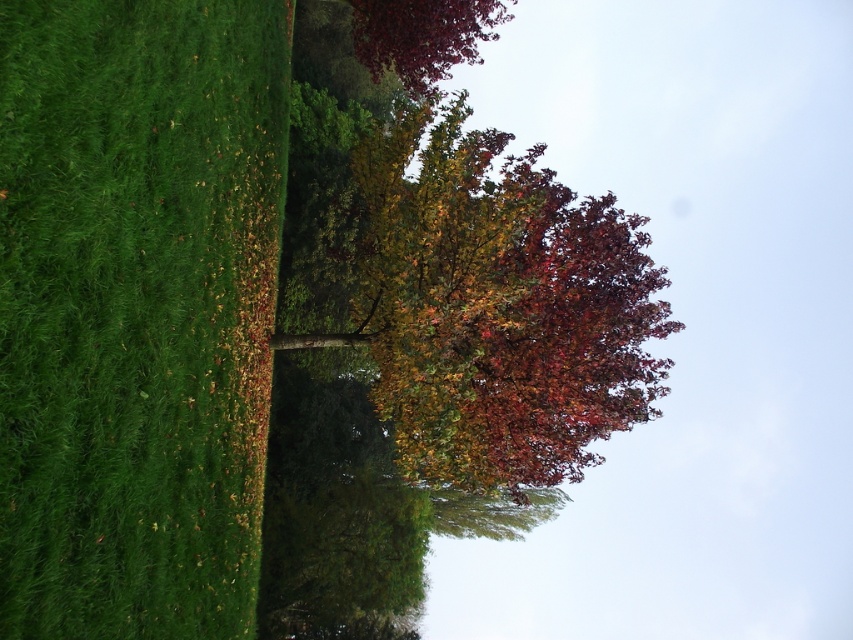
What can be found at the coordinates point (494, 305) in the image?

Multicolored foliage at center can be found at point (494, 305).

You are standing in the middle of the scene and want to walk towards the green grassy hedge at left. Which direction should you walk to avoid the shiny burgundy leaves at upper center?

The green grassy hedge at left is positioned under the shiny burgundy leaves at upper center, so walking towards the left while staying close to the hedge will help avoid the leaves above.